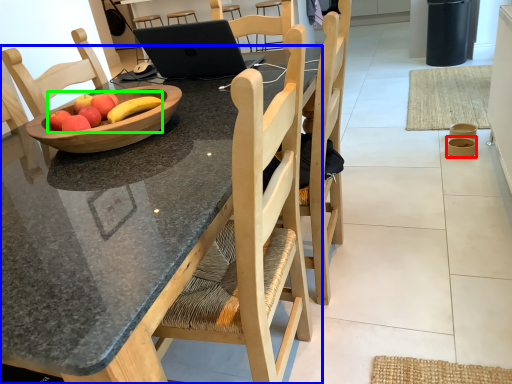
Question: Which is nearer to the bowl (highlighted by a red box)? desk (highlighted by a blue box) or fruit (highlighted by a green box).

Choices:
 (A) desk
 (B) fruit

Answer: (B)